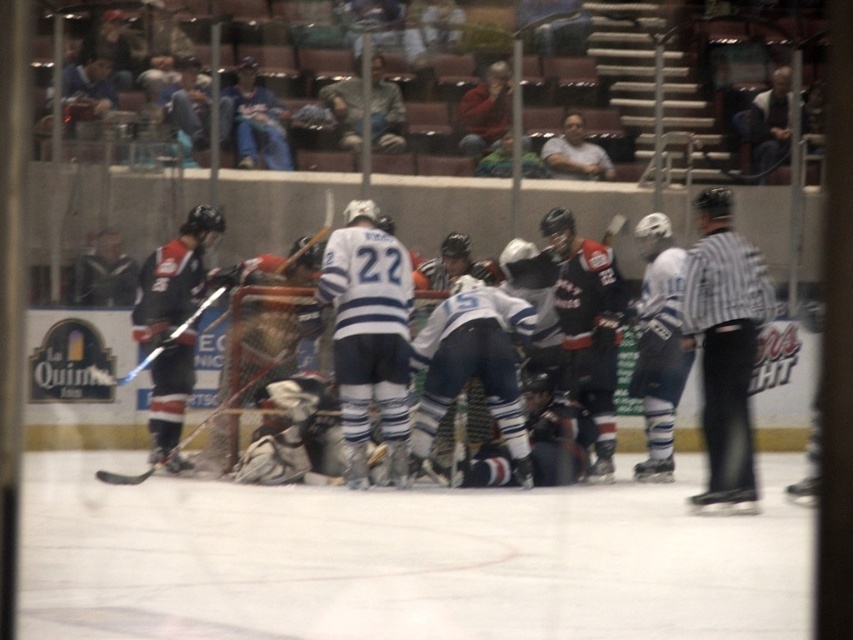
You are a referee watching the hockey game. You need to determine the positions of the black striped shirt at right and white jersey at center. Which player is positioned more to the right side of the image?

The black striped shirt at right is positioned more to the right side of the image than the white jersey at center.

You are a photographer at the hockey game. You want to take a photo of the black striped shirt at right and the white jersey at center. Which one should you zoom in on to capture more details?

The black striped shirt at right is bigger than the white jersey at center, so you should zoom in on the black striped shirt at right to capture more details.

You are a referee positioned at the center of the ice. You need to quickly locate the matte black jersey at left. Based on the coordinates provided, in which general direction should you look to find it?

The matte black jersey at left is located at point coordinates 0.511 on the x axis and 0.203 on the y axis. Since the x coordinate is closer to 0.5, it is centrally positioned horizontally, but the y coordinate of 0.203 indicates it is closer to the bottom of the image. Therefore, you should look downward and slightly to the center to locate it.